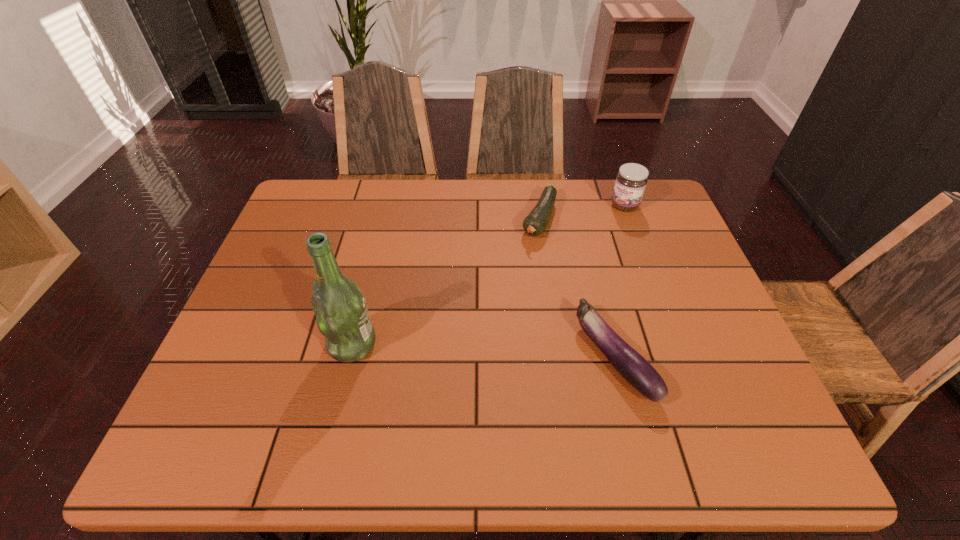
This screenshot has height=540, width=960. I want to click on free space on the desktop that is between the tallest object and the eggplant and is positioned at the blossom end of the zucchini, so [461, 350].

You are a GUI agent. You are given a task and a screenshot of the screen. Output one action in this format:
    pyautogui.click(x=<x>, y=<y>)
    Task: Click on the vacant space on the desktop that is between the tallest object and the eggplant and is positioned on the front label of the jam
    This screenshot has height=540, width=960.
    Given the screenshot: What is the action you would take?
    pyautogui.click(x=517, y=353)